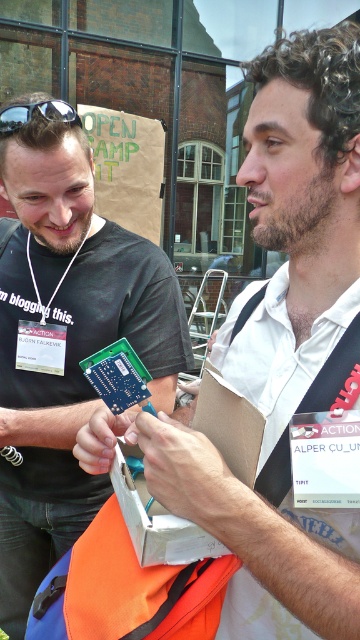
Between matte black shirt at upper left and black plastic goggles at upper left, which one appears on the left side from the viewer's perspective?

From the viewer's perspective, black plastic goggles at upper left appears more on the left side.

Does matte black shirt at upper left have a smaller size compared to black plastic goggles at upper left?

Incorrect, matte black shirt at upper left is not smaller in size than black plastic goggles at upper left.

Which is behind, point (74, 141) or point (23, 113)?

Positioned behind is point (74, 141).

Identify the location of matte black shirt at upper left. [x=65, y=346].